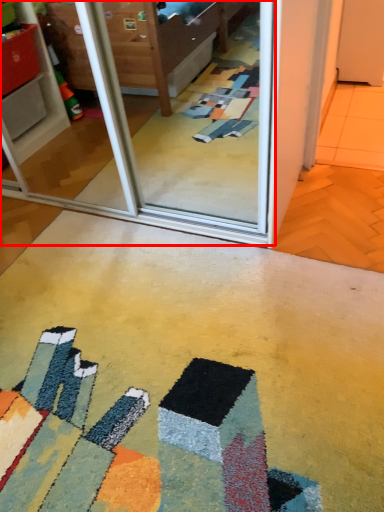
Question: From the image's perspective, where is screen door (annotated by the red box) located in relation to concrete in the image?

Choices:
 (A) above
 (B) below

Answer: (A)